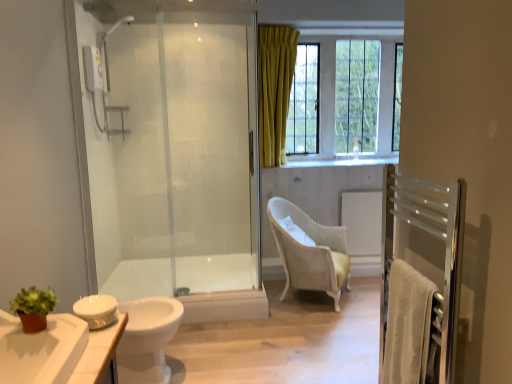
Identify the location of vacant area to the left of white glossy faucet at upper center. (347, 163).